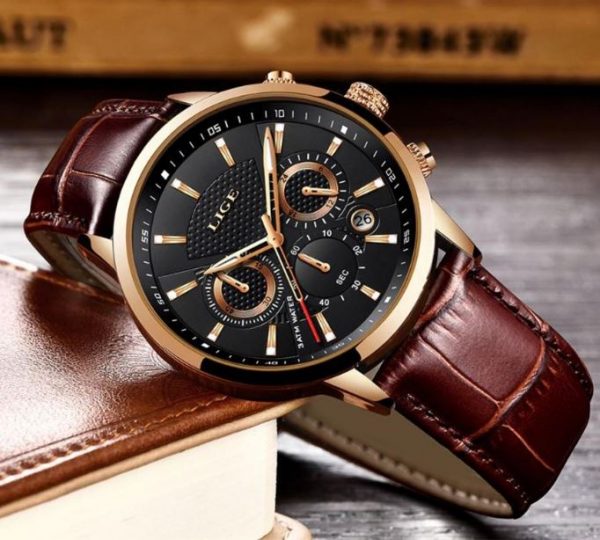
You are a GUI agent. You are given a task and a screenshot of the screen. Output one action in this format:
    pyautogui.click(x=<x>, y=<y>)
    Task: Click on the table
    
    Given the screenshot: What is the action you would take?
    click(x=547, y=262)